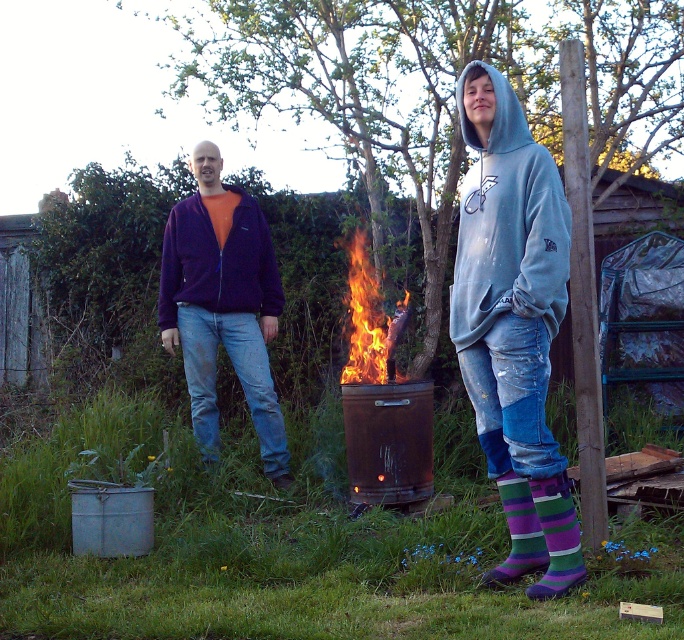
Is point (254, 209) closer to camera compared to point (523, 557)?

No, it is behind (523, 557).

Can you confirm if purple fleece jacket at left is smaller than purple striped sock at lower right?

No, purple fleece jacket at left is not smaller than purple striped sock at lower right.

Between point (198, 230) and point (538, 525), which one is positioned in front?

Point (538, 525) is in front.

Locate an element on the screen. The height and width of the screenshot is (640, 684). purple fleece jacket at left is located at coordinates (218, 260).

Is purple fleece jacket at left to the right of flaming wood at center from the viewer's perspective?

Incorrect, purple fleece jacket at left is not on the right side of flaming wood at center.

Based on the photo, can you confirm if purple fleece jacket at left is thinner than flaming wood at center?

No, purple fleece jacket at left is not thinner than flaming wood at center.

Is point (181, 248) behind point (389, 321)?

That is True.

Find the location of `purple fleece jacket at left`. purple fleece jacket at left is located at coordinates (218, 260).

Is point (239, 371) farther from camera compared to point (484, 166)?

Yes, it is behind point (484, 166).

What do you see at coordinates (222, 305) in the screenshot? Image resolution: width=684 pixels, height=640 pixels. I see `purple fleece jacket at center` at bounding box center [222, 305].

Image resolution: width=684 pixels, height=640 pixels. I want to click on purple fleece jacket at center, so click(222, 305).